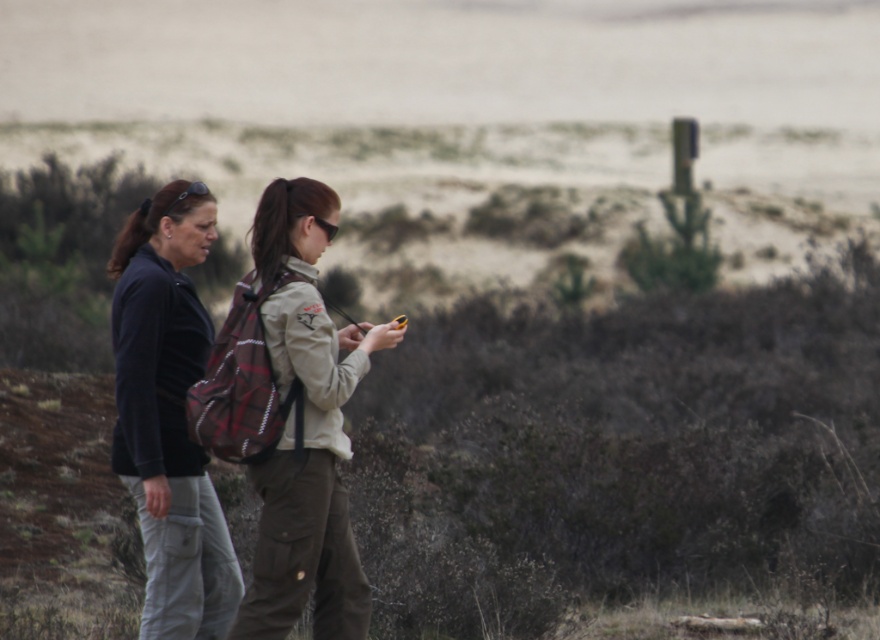
You are trying to locate the plaid fabric backpack at center and the dark blue fleece jacket at left in the image. According to the scene, which object is positioned to the right of the other?

The plaid fabric backpack at center is to the right of the dark blue fleece jacket at left.

You are planning to pack your camping gear. You have a sleeping bag that requires 20 inches of space. You see the plaid fabric backpack at center and the dark blue fleece jacket at left. Which item can accommodate the sleeping bag based on their widths?

The plaid fabric backpack at center might be wider than dark blue fleece jacket at left, so it can accommodate the sleeping bag that requires 20 inches of space.